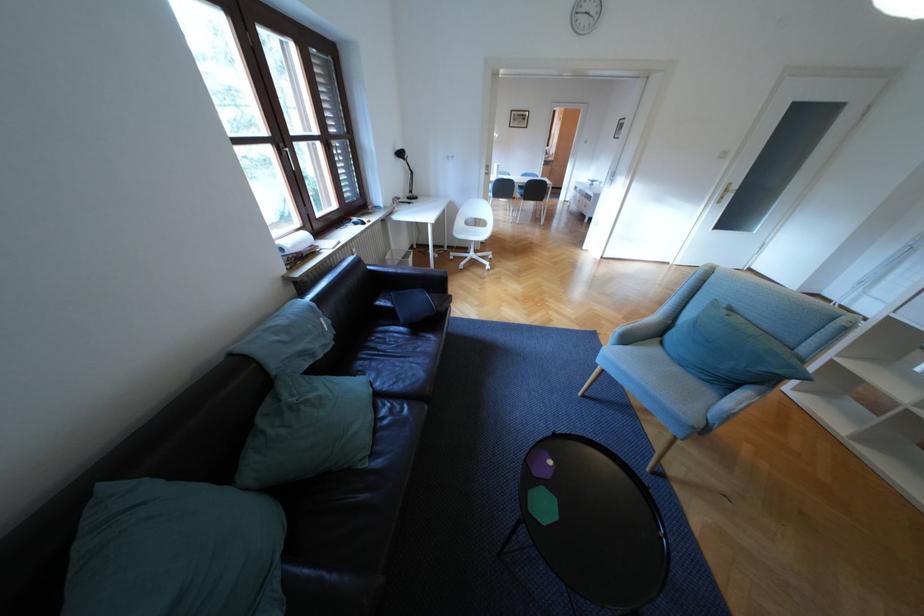
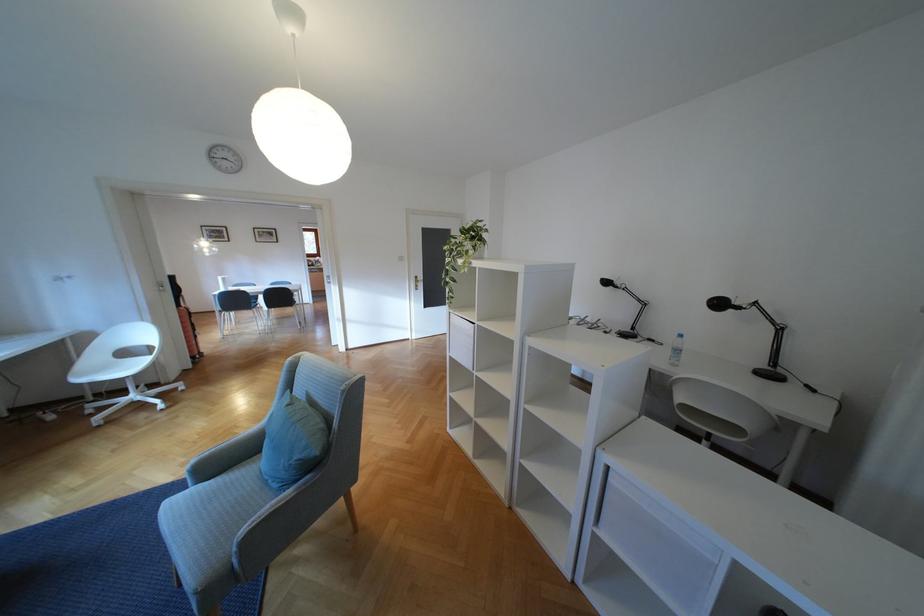
Locate, in the second image, the point that corresponds to [469,222] in the first image.

(104, 358)